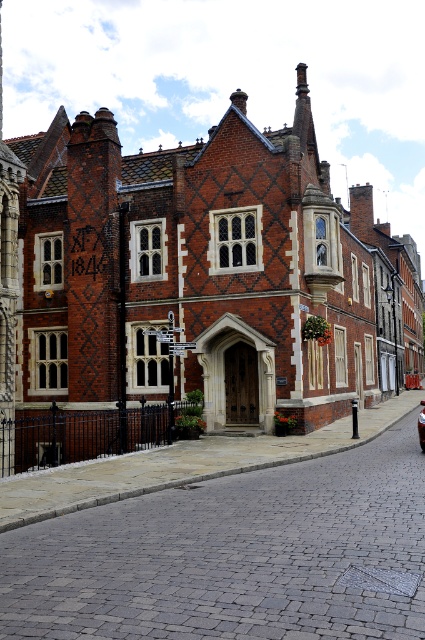
Can you confirm if brick building at center is smaller than shiny red car at center?

Actually, brick building at center might be larger than shiny red car at center.

Who is more forward, (x=16, y=412) or (x=422, y=408)?

Point (x=16, y=412)

Locate an element on the screen. The width and height of the screenshot is (425, 640). brick building at center is located at coordinates (198, 285).

I want to click on brick building at center, so click(x=198, y=285).